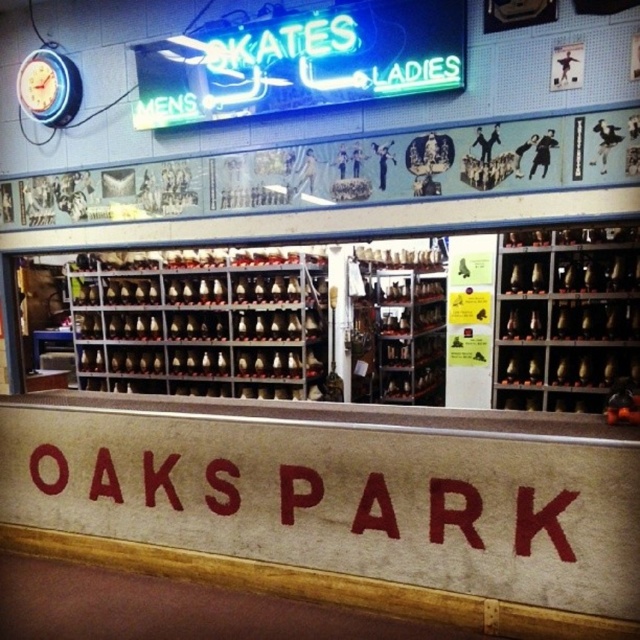
You are a customer in the Oaks Park skating rink shop. You see the metallic silver skates at center and the red painted sign at center. Which object is closer to you?

The metallic silver skates at center are closer to you because the red painted sign at center is behind them.

You are a customer at the Oaks Park skating rink shop. You see the metallic silver skates at center and the red painted sign at center. Which object is bigger in size?

The metallic silver skates at center has a larger size compared to the red painted sign at center.